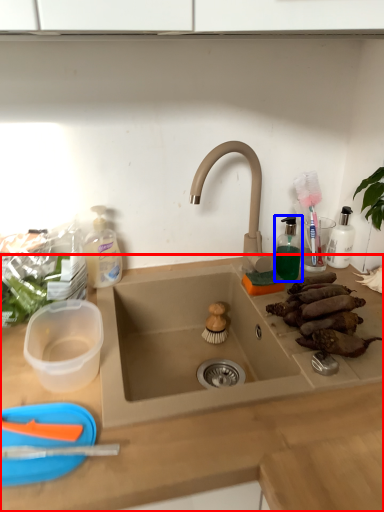
Question: Which of the following is the farthest to the observer, countertop (highlighted by a red box) or toiletry (highlighted by a blue box)?

Choices:
 (A) countertop
 (B) toiletry

Answer: (B)